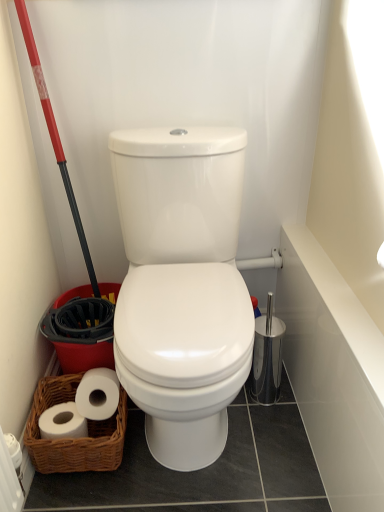
This screenshot has width=384, height=512. In order to click on free space in front of woven brown basket at lower left in this screenshot , I will do `click(99, 483)`.